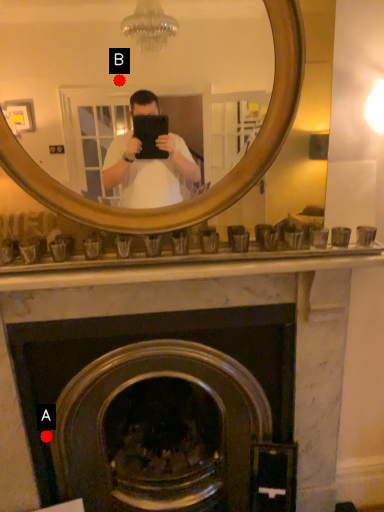
Question: Two points are circled on the image, labeled by A and B beside each circle. Which point is closer to the camera?

Choices:
 (A) A is closer
 (B) B is closer

Answer: (B)